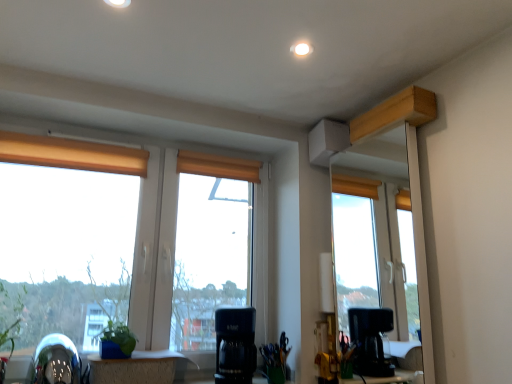
This screenshot has width=512, height=384. Identify the location of green leafy plant at lower left. (10, 317).

Image resolution: width=512 pixels, height=384 pixels. What do you see at coordinates (218, 166) in the screenshot? I see `orange fabric curtain at center, the second curtain when ordered from left to right` at bounding box center [218, 166].

What is the approximate height of black plastic coffee maker at center?

It is 33.07 centimeters.

Find the location of a particular element. This screenshot has width=512, height=384. shiny metallic swivel chair at lower left is located at coordinates (58, 362).

What is the approximate width of wooden table at lower center?

wooden table at lower center is 8.65 inches in width.

Identify the location of matte wooden window at center. This screenshot has height=384, width=512. point(139,207).

This screenshot has height=384, width=512. I want to click on green leafy plant at lower left, so (x=10, y=317).

Is point (143, 259) less distant than point (143, 373)?

No, it is behind (143, 373).

Between matte wooden window at center and wooden table at lower center, which one has smaller size?

wooden table at lower center.

Is wooden table at lower center completely or partially inside matte wooden window at center?

No, wooden table at lower center is not surrounded by matte wooden window at center.

Between matte wooden window at center and wooden table at lower center, which one has less height?

With less height is wooden table at lower center.

Is green leafy plant at lower left wider or thinner than orange fabric curtain at center, placed as the 2th curtain when sorted from front to back?

Clearly, green leafy plant at lower left has more width compared to orange fabric curtain at center, placed as the 2th curtain when sorted from front to back.

Is green leafy plant at lower left to the right of orange fabric curtain at center, the 1th curtain from the right, from the viewer's perspective?

Incorrect, green leafy plant at lower left is not on the right side of orange fabric curtain at center, the 1th curtain from the right.

Considering the points (3, 313) and (177, 172), which point is behind, point (3, 313) or point (177, 172)?

The point (177, 172) is more distant.

Does green leafy plant at lower left have a larger size compared to orange fabric curtain at center, placed as the 2th curtain when sorted from front to back?

Correct, green leafy plant at lower left is larger in size than orange fabric curtain at center, placed as the 2th curtain when sorted from front to back.

Consider the image. Between orange fabric curtain at upper left, the 2th curtain when ordered from right to left, and black plastic coffee maker at center, which one appears on the left side from the viewer's perspective?

orange fabric curtain at upper left, the 2th curtain when ordered from right to left.

Does point (23, 156) appear closer or farther from the camera than point (244, 323)?

Clearly, point (23, 156) is more distant from the camera than point (244, 323).

Is orange fabric curtain at upper left, the 2th curtain when ordered from right to left, positioned beyond the bounds of black plastic coffee maker at center?

Yes.

In the scene shown: Could you tell me if orange fabric curtain at upper left, which is counted as the 1th curtain, starting from the front, is facing black plastic coffee maker at center?

No.

Is shiny metallic swivel chair at lower left positioned before matte wooden window at center?

Yes, shiny metallic swivel chair at lower left is in front of matte wooden window at center.

Considering the sizes of objects shiny metallic swivel chair at lower left and matte wooden window at center in the image provided, who is bigger, shiny metallic swivel chair at lower left or matte wooden window at center?

With larger size is matte wooden window at center.

Would you say shiny metallic swivel chair at lower left is a long distance from matte wooden window at center?

No, shiny metallic swivel chair at lower left is in close proximity to matte wooden window at center.

Identify the location of swivel chair below the matte wooden window at center (from a real-world perspective). The image size is (512, 384). (58, 362).

Does shiny metallic swivel chair at lower left have a greater width compared to black plastic coffee maker at center?

Yes, shiny metallic swivel chair at lower left is wider than black plastic coffee maker at center.

Measure the distance between shiny metallic swivel chair at lower left and black plastic coffee maker at center.

shiny metallic swivel chair at lower left is 24.65 inches away from black plastic coffee maker at center.

From the picture: Can you confirm if shiny metallic swivel chair at lower left is shorter than black plastic coffee maker at center?

Indeed, shiny metallic swivel chair at lower left has a lesser height compared to black plastic coffee maker at center.

Is shiny metallic swivel chair at lower left far from black plastic coffee maker at center?

They are positioned close to each other.

Measure the distance from matte wooden window at center to shiny metallic swivel chair at lower left.

matte wooden window at center and shiny metallic swivel chair at lower left are 50.59 centimeters apart.

From the image's perspective, which object appears higher, matte wooden window at center or shiny metallic swivel chair at lower left?

matte wooden window at center, from the image's perspective.

Based on the photo, from a real-world perspective, which object rests below the other?

shiny metallic swivel chair at lower left.

Is matte wooden window at center positioned with its back to shiny metallic swivel chair at lower left?

Yes, matte wooden window at center is positioned with its back facing shiny metallic swivel chair at lower left.

Consider the image. Which of these two, shiny metallic swivel chair at lower left or orange fabric curtain at center, placed as the 2th curtain when sorted from front to back, is thinner?

orange fabric curtain at center, placed as the 2th curtain when sorted from front to back.

Based on the photo, which is more to the right, shiny metallic swivel chair at lower left or orange fabric curtain at center, placed as the 2th curtain when sorted from front to back?

orange fabric curtain at center, placed as the 2th curtain when sorted from front to back.

Is shiny metallic swivel chair at lower left oriented away from orange fabric curtain at center, placed as the 2th curtain when sorted from front to back?

No.

Looking at this image, can you confirm if shiny metallic swivel chair at lower left is taller than orange fabric curtain at center, placed as the 2th curtain when sorted from front to back?

Indeed, shiny metallic swivel chair at lower left has a greater height compared to orange fabric curtain at center, placed as the 2th curtain when sorted from front to back.

This screenshot has height=384, width=512. Identify the location of window that appears above the wooden table at lower center (from a real-world perspective). (139, 207).

Where is `plant below the orange fabric curtain at center, the second curtain when ordered from left to right (from the image's perspective)`? plant below the orange fabric curtain at center, the second curtain when ordered from left to right (from the image's perspective) is located at coordinates (10, 317).

Consider the image. Looking at the image, which one is located further to shiny metallic swivel chair at lower left, green leafy plant at lower left or black plastic coffee maker at center?

black plastic coffee maker at center is positioned further to the anchor shiny metallic swivel chair at lower left.

Based on the photo, considering their positions, is matte wooden window at center positioned further to green matte plant at lower left than orange fabric curtain at upper left, the first curtain when ordered from left to right?

orange fabric curtain at upper left, the first curtain when ordered from left to right, lies further to green matte plant at lower left than the other object.

Based on the photo, based on their spatial positions, is matte wooden window at center or green matte plant at lower left further from wooden table at lower center?

matte wooden window at center.

Considering their positions, is green matte plant at lower left positioned further to orange fabric curtain at upper left, which is counted as the 1th curtain, starting from the front, than orange fabric curtain at center, the second curtain when ordered from left to right?

Based on the image, green matte plant at lower left appears to be further to orange fabric curtain at upper left, which is counted as the 1th curtain, starting from the front.

Which object lies nearer to the anchor point green leafy plant at lower left, matte wooden window at center or orange fabric curtain at upper left, the 2th curtain when ordered from right to left?

The object closer to green leafy plant at lower left is matte wooden window at center.

Which object lies nearer to the anchor point orange fabric curtain at upper left, which is the 2th curtain from back to front, orange fabric curtain at center, the second curtain when ordered from left to right, or wooden table at lower center?

orange fabric curtain at center, the second curtain when ordered from left to right, is closer to orange fabric curtain at upper left, which is the 2th curtain from back to front.

From the image, which object appears to be nearer to orange fabric curtain at upper left, which is counted as the 1th curtain, starting from the front, matte wooden window at center or wooden table at lower center?

matte wooden window at center is positioned closer to the anchor orange fabric curtain at upper left, which is counted as the 1th curtain, starting from the front.

When comparing their distances from wooden table at lower center, does black plastic coffee maker at center or orange fabric curtain at upper left, which is counted as the 1th curtain, starting from the front, seem further?

orange fabric curtain at upper left, which is counted as the 1th curtain, starting from the front.

Locate an element on the screen. window between orange fabric curtain at center, the second curtain when ordered from left to right, and shiny metallic swivel chair at lower left, in the vertical direction is located at coordinates (139, 207).

The image size is (512, 384). What are the coordinates of `window between orange fabric curtain at center, placed as the 2th curtain when sorted from front to back, and black plastic coffee maker at center, in the vertical direction` in the screenshot? It's located at (139, 207).

Locate an element on the screen. This screenshot has width=512, height=384. table situated between shiny metallic swivel chair at lower left and black plastic coffee maker at center from left to right is located at coordinates (136, 368).

Where is `swivel chair situated between green leafy plant at lower left and black plastic coffee maker at center from left to right`? swivel chair situated between green leafy plant at lower left and black plastic coffee maker at center from left to right is located at coordinates (58, 362).